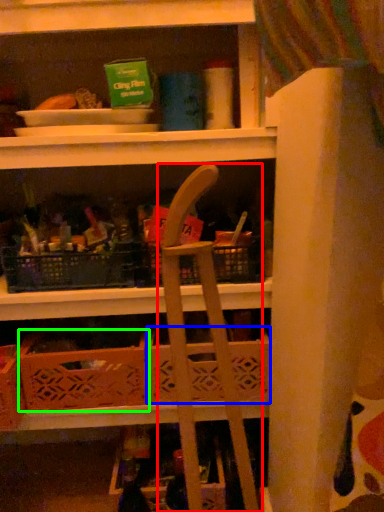
Question: Which is farther away from folding chair (highlighted by a red box)? basket (highlighted by a blue box) or crate (highlighted by a green box)?

Choices:
 (A) basket
 (B) crate

Answer: (B)